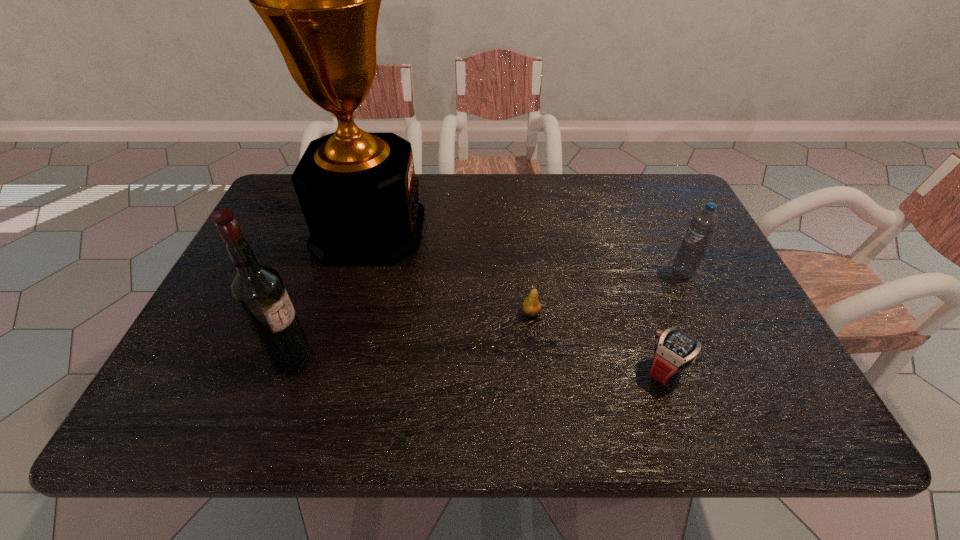
Locate an element on the screen. the tallest object is located at coordinates (320, 0).

What are the coordinates of `the fourth shortest object` in the screenshot? It's located at (258, 290).

The image size is (960, 540). In order to click on the rightmost object in this screenshot , I will do `click(703, 224)`.

Identify the location of water bottle. (703, 224).

Where is `the third nearest object`? Image resolution: width=960 pixels, height=540 pixels. the third nearest object is located at coordinates (531, 306).

Identify the location of pear. The image size is (960, 540). (531, 306).

In order to click on the fourth object from left to right in this screenshot , I will do `click(675, 350)`.

The image size is (960, 540). In order to click on vacant space situated 0.350m on the front of the tallest object with the label in this screenshot , I will do coord(548,230).

The image size is (960, 540). Identify the location of free region located on the front and back of the wine bottle. (414, 360).

Locate an element on the screen. Image resolution: width=960 pixels, height=540 pixels. free location located on the front of the third tallest object is located at coordinates (715, 342).